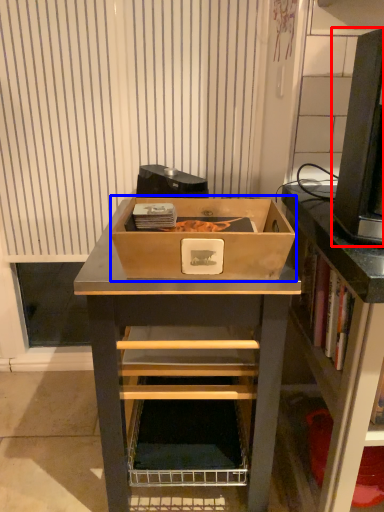
Question: Which point is closer to the camera, desktop computer (highlighted by a red box) or box (highlighted by a blue box)?

Choices:
 (A) desktop computer
 (B) box

Answer: (A)